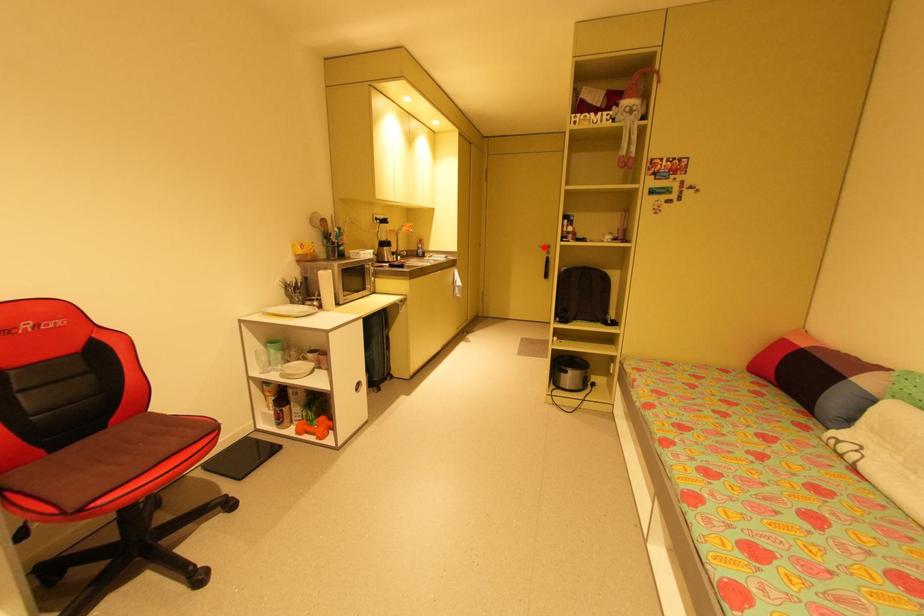
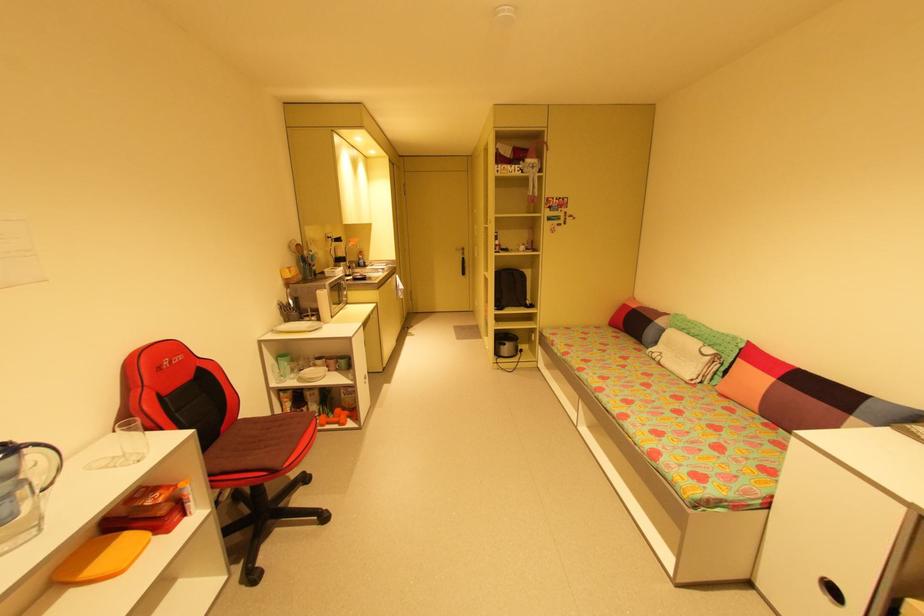
In the second image, find the point that corresponds to the highlighted location in the first image.

(460, 249)